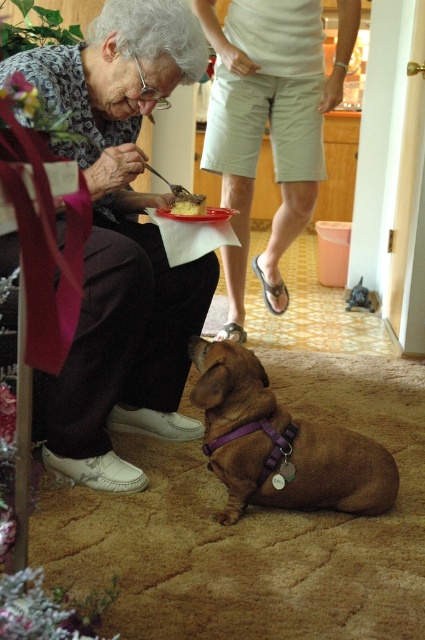
Is point (340, 38) less distant than point (176, 186)?

That is False.

This screenshot has height=640, width=425. Identify the location of light beige shorts at center. (269, 122).

Between point (263, 8) and point (189, 204), which one is positioned behind?

Point (263, 8)

At what (x,y) coordinates should I click in order to perform the action: click on light beige shorts at center. Please return your answer as a coordinate pair (x, y). Looking at the image, I should click on (269, 122).

Which is below, brown leather dog at lower center or matte plastic plate at center?

brown leather dog at lower center is below.

Is brown leather dog at lower center shorter than matte plastic plate at center?

No, brown leather dog at lower center is not shorter than matte plastic plate at center.

Does point (220, 376) lie in front of point (209, 218)?

Yes, it is in front of point (209, 218).

The height and width of the screenshot is (640, 425). What are the coordinates of `brown leather dog at lower center` in the screenshot? It's located at (280, 444).

Does matte black sweater at upper left have a smaller size compared to brown leather dog at lower center?

No.

Between matte black sweater at upper left and brown leather dog at lower center, which one has more height?

Standing taller between the two is matte black sweater at upper left.

Where is `matte black sweater at upper left`? matte black sweater at upper left is located at coordinates (121, 243).